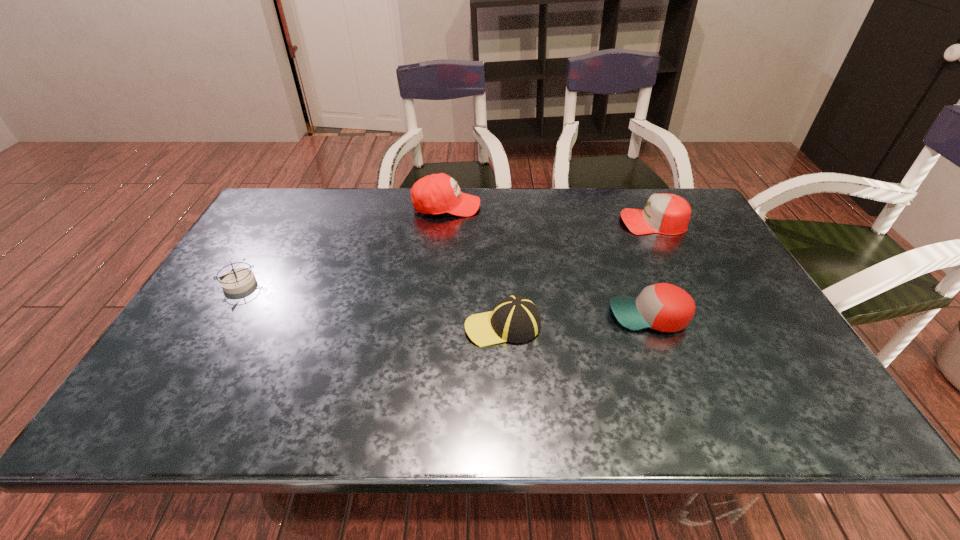
You are a GUI agent. You are given a task and a screenshot of the screen. Output one action in this format:
    pyautogui.click(x=<x>, y=<y>)
    Task: Click on the vacant space at the left edge of the desktop
    Image resolution: width=960 pixels, height=540 pixels.
    Given the screenshot: What is the action you would take?
    pyautogui.click(x=265, y=251)

The width and height of the screenshot is (960, 540). I want to click on vacant space at the right edge of the desktop, so click(733, 311).

Image resolution: width=960 pixels, height=540 pixels. In order to click on vacant space at the far left corner in this screenshot , I will do `click(295, 222)`.

Find the location of a particular element. The image size is (960, 540). free space at the far right corner of the desktop is located at coordinates (703, 221).

In order to click on vacant region between the tallest object and the third farthest object in this screenshot , I will do `click(343, 245)`.

Identify the location of object that can be found as the third closest to the compass. This screenshot has height=540, width=960. (664, 307).

Point out which object is positioned as the fourth nearest to the tallest baseball cap. Please provide its 2D coordinates. Your answer should be formatted as a tuple, i.e. [(x, y)], where the tuple contains the x and y coordinates of a point satisfying the conditions above.

[(664, 307)]

Select which baseball cap appears as the second closest to the tallest baseball cap. Please provide its 2D coordinates. Your answer should be formatted as a tuple, i.e. [(x, y)], where the tuple contains the x and y coordinates of a point satisfying the conditions above.

[(668, 214)]

Locate which baseball cap is the closest to the tallest object. Please provide its 2D coordinates. Your answer should be formatted as a tuple, i.e. [(x, y)], where the tuple contains the x and y coordinates of a point satisfying the conditions above.

[(515, 319)]